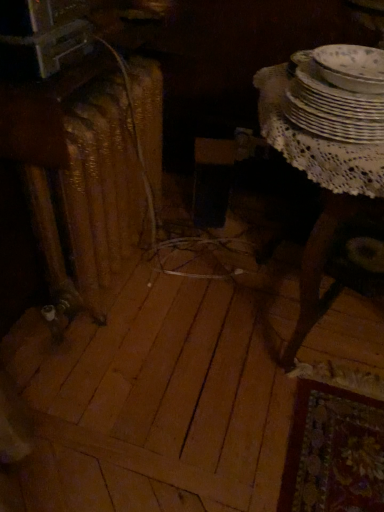
Where is `vacant space in white lace table at right (from a real-world perspective)`? This screenshot has width=384, height=512. vacant space in white lace table at right (from a real-world perspective) is located at coordinates (289, 317).